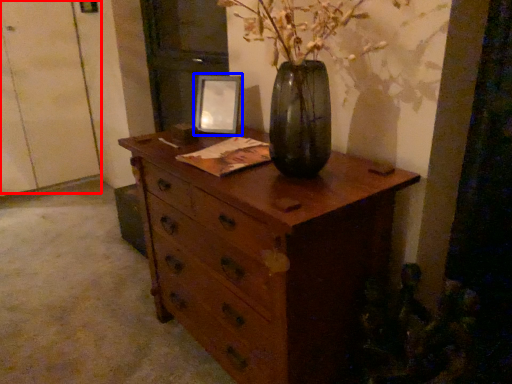
Question: Which of the following is the closest to the observer, door (highlighted by a red box) or picture frame (highlighted by a blue box)?

Choices:
 (A) door
 (B) picture frame

Answer: (B)